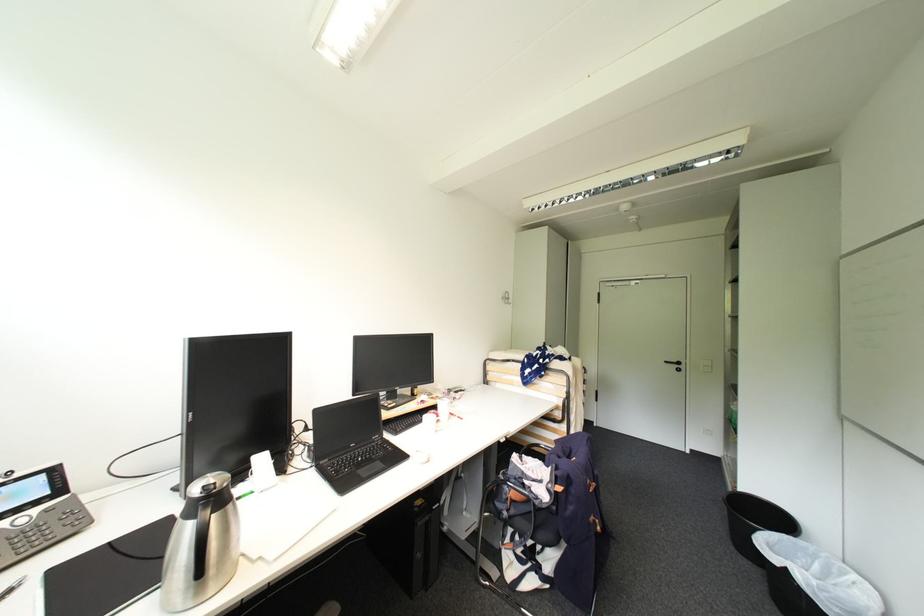
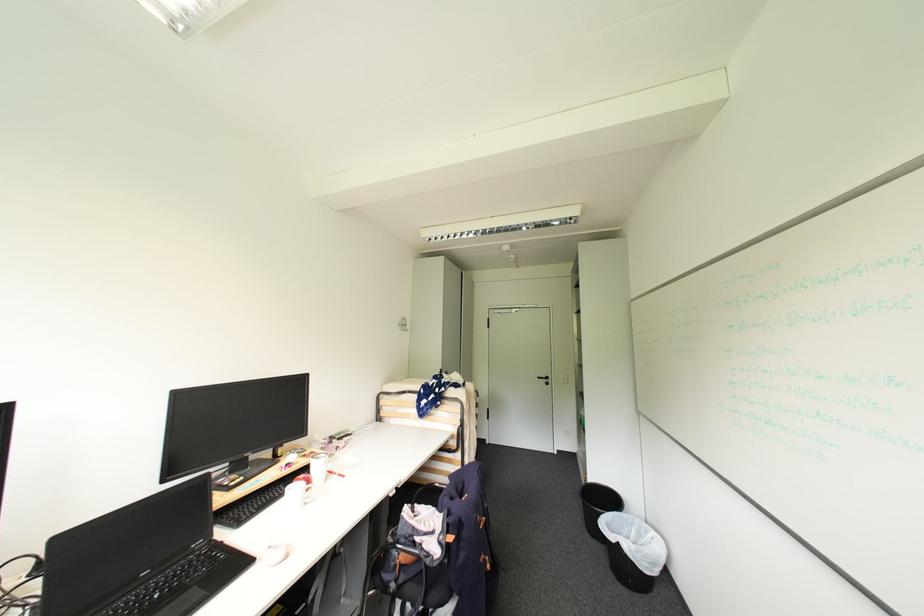
Where in the second image is the point corresponding to (x=673, y=363) from the first image?

(544, 379)